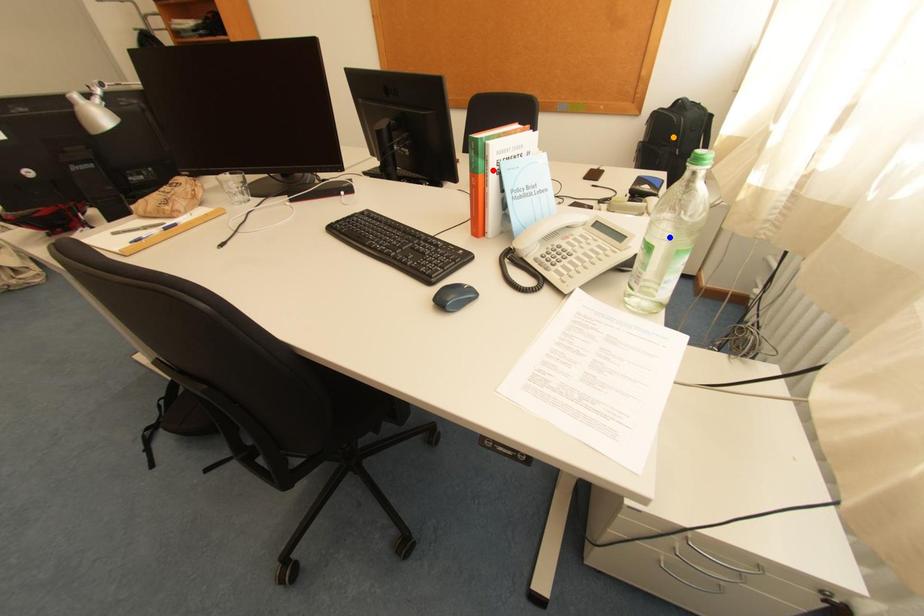
Order these from nearest to farthest:
- orange point
- blue point
- red point

blue point, red point, orange point